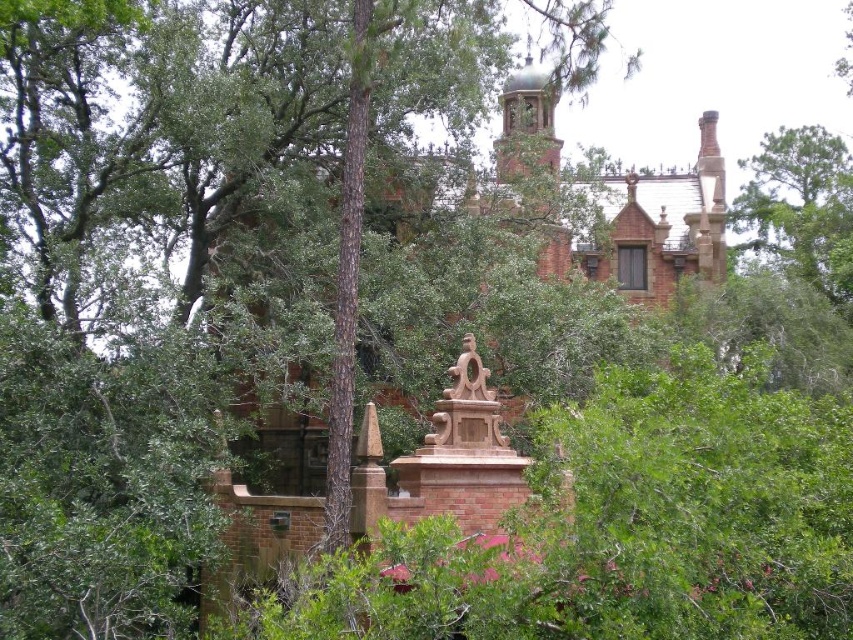
Question: Does green leafy tree at upper right appear on the left side of carved stone statue at center?

Choices:
 (A) no
 (B) yes

Answer: (A)

Question: Which point is farther to the camera?

Choices:
 (A) (792, 230)
 (B) (467, 387)

Answer: (A)

Question: Does green leafy tree at upper right appear on the right side of carved stone statue at center?

Choices:
 (A) no
 (B) yes

Answer: (B)

Question: Which of the following is the farthest from the observer?

Choices:
 (A) carved stone statue at center
 (B) green leafy tree at upper right

Answer: (B)

Question: In this image, where is green leafy tree at upper right located relative to carved stone statue at center?

Choices:
 (A) below
 (B) above

Answer: (B)